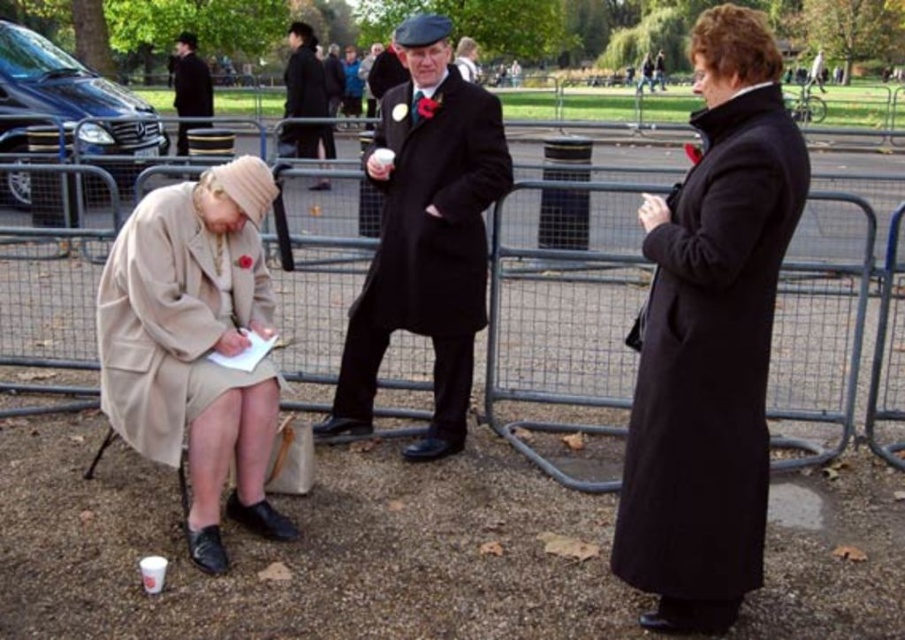
Is black wool coat at right further to the viewer compared to black wool coat at upper left?

No, it is not.

Can you confirm if black wool coat at right is positioned to the right of black wool coat at upper left?

Indeed, black wool coat at right is positioned on the right side of black wool coat at upper left.

Image resolution: width=905 pixels, height=640 pixels. I want to click on black wool coat at right, so click(710, 358).

The width and height of the screenshot is (905, 640). Identify the location of matte black coat at center. (425, 236).

Measure the distance between point (x=493, y=156) and camera.

The distance of point (x=493, y=156) from camera is 3.83 meters.

Where is `matte black coat at center`? The width and height of the screenshot is (905, 640). matte black coat at center is located at coordinates (425, 236).

Does metal fence at center appear under beige woolen coat at lower left?

No, metal fence at center is not below beige woolen coat at lower left.

How much distance is there between metal fence at center and beige woolen coat at lower left?

metal fence at center is 2.68 meters from beige woolen coat at lower left.

Identify the location of metal fence at center. (563, 307).

The width and height of the screenshot is (905, 640). What are the coordinates of `metal fence at center` in the screenshot? It's located at (563, 307).